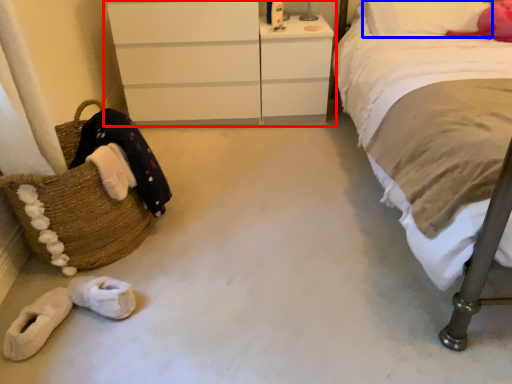
Question: Among these objects, which one is farthest to the camera, chest of drawers (highlighted by a red box) or pillow (highlighted by a blue box)?

Choices:
 (A) chest of drawers
 (B) pillow

Answer: (A)